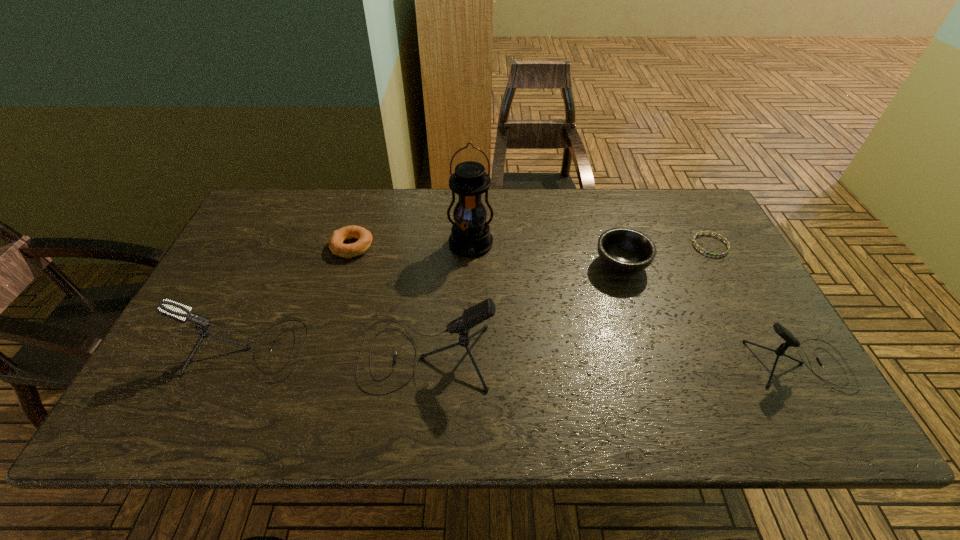
Where is `vacant space at the right edge of the desktop`? vacant space at the right edge of the desktop is located at coordinates (731, 298).

Locate an element on the screen. This screenshot has height=540, width=960. vacant space at the far left corner of the desktop is located at coordinates (262, 227).

Identify the location of vacant space at the far right corner of the desktop. (664, 212).

I want to click on free spot between the fifth shortest object and the bracelet, so click(x=478, y=298).

Locate an element on the screen. vacant point located between the tallest object and the shortest object is located at coordinates (590, 245).

The width and height of the screenshot is (960, 540). Identify the location of free area in between the rightmost microphone and the bagel. (575, 306).

At what (x,y) coordinates should I click in order to perform the action: click on vacant area that lies between the bracelet and the leftmost microphone. Please return your answer as a coordinate pair (x, y). This screenshot has height=540, width=960. Looking at the image, I should click on (478, 298).

What are the coordinates of `unoccupied position between the bracelet and the sixth tallest object` in the screenshot? It's located at (531, 246).

Find the location of a particular element. Image resolution: width=960 pixels, height=540 pixels. free space between the leftmost microphone and the fourth tallest object is located at coordinates (522, 358).

The width and height of the screenshot is (960, 540). Identify the location of free space between the shortest object and the third object from right to left. (665, 255).